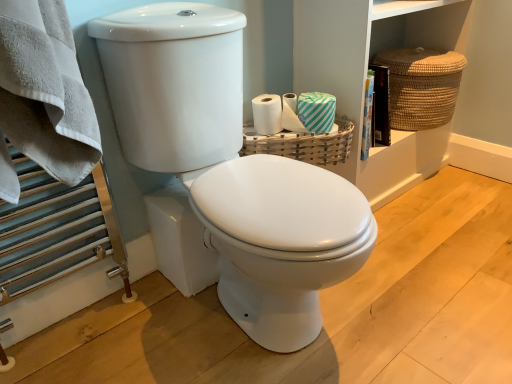
You are a GUI agent. You are given a task and a screenshot of the screen. Output one action in this format:
    pyautogui.click(x=<x>, y=<y>)
    Task: Click on the free space in front of white glossy toilet at center, which is the first toilet from back to front
    The width and height of the screenshot is (512, 384).
    Given the screenshot: What is the action you would take?
    pyautogui.click(x=254, y=339)